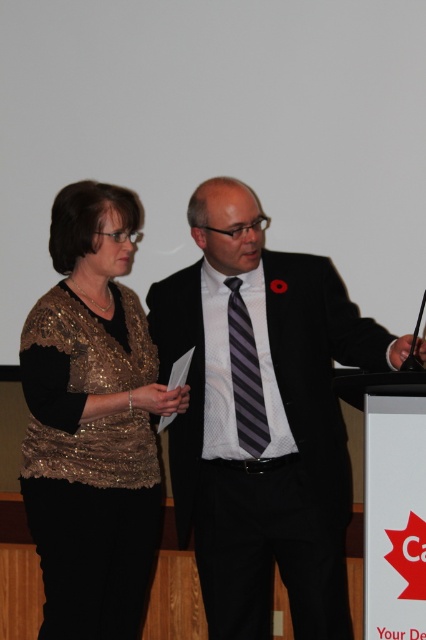
You are an event planner trying to place a name tag on the podium for the person in the black suit at center. According to the coordinates provided, where exactly should you place it?

The black suit at center is located at coordinates point (261, 417), so the name tag should be placed there.

You are organizing a photo shoot and need to place a large backdrop behind the black suit at center and the gold sequined vest at left. Since the backdrop must be wide enough to cover both, which object requires the backdrop to be wider to accommodate its size?

The black suit at center requires the backdrop to be wider because its width is larger than the gold sequined vest at left.